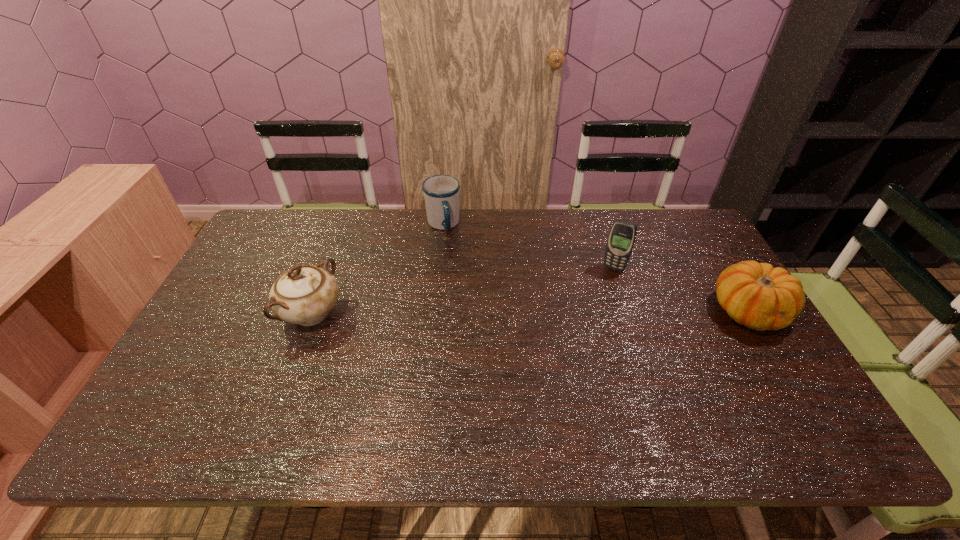
Locate an element on the screen. This screenshot has width=960, height=540. vacant position located on the handle side of the mug is located at coordinates (483, 326).

What are the coordinates of `free location located 0.390m on the screen of the cellular telephone` in the screenshot? It's located at (562, 363).

Locate an element on the screen. The width and height of the screenshot is (960, 540). vacant space situated 0.340m on the screen of the cellular telephone is located at coordinates (569, 350).

This screenshot has width=960, height=540. Find the location of `free space located 0.400m on the screen of the cellular telephone`. free space located 0.400m on the screen of the cellular telephone is located at coordinates [561, 366].

Identify the location of object located at the far edge. This screenshot has width=960, height=540. (441, 192).

The width and height of the screenshot is (960, 540). I want to click on object at the right edge, so click(757, 295).

In the image, there is a desktop. Where is `vacant region at the far edge`? vacant region at the far edge is located at coordinates (547, 218).

Locate an element on the screen. This screenshot has height=540, width=960. free space at the near edge of the desktop is located at coordinates (718, 393).

This screenshot has width=960, height=540. In the image, there is a desktop. Identify the location of vacant area at the right edge. (782, 366).

Where is `blank space at the near right corner`? blank space at the near right corner is located at coordinates (771, 397).